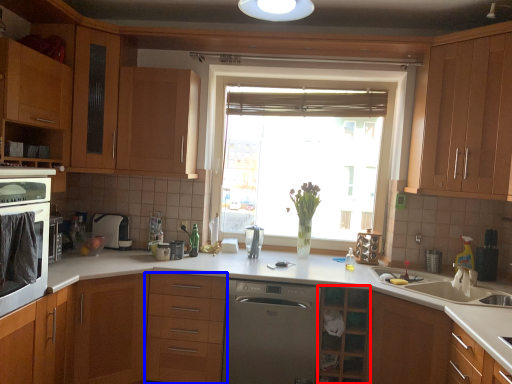
Question: Which point is closer to the camera, cabinetry (highlighted by a red box) or drawer (highlighted by a blue box)?

Choices:
 (A) cabinetry
 (B) drawer

Answer: (A)